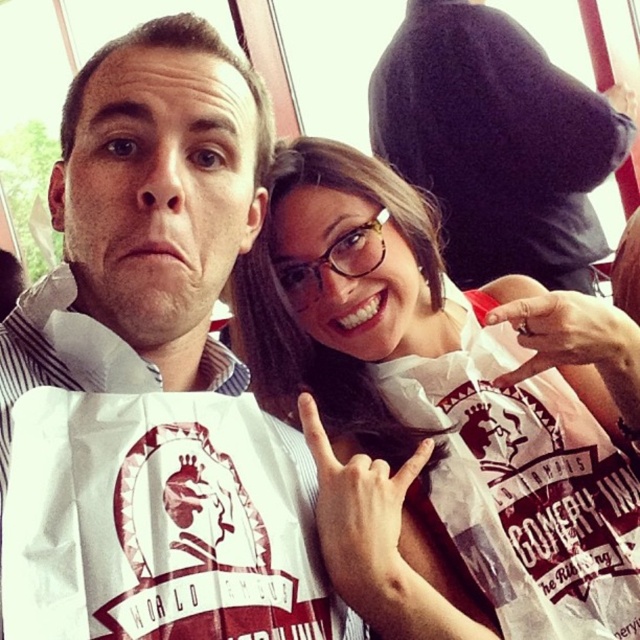
You are organizing a photo shoot and need to ensure that all items in the frame are correctly sized according to the client specifications. The client has specified that the white paper bag at center must be larger than the matte black shirt at upper center. Based on the image provided, does the current arrangement meet the client requirements? Please explain your reasoning.

The white paper bag at center is smaller than the matte black shirt at upper center, so the current arrangement does not meet the client requirement that the white paper bag at center must be larger than the matte black shirt at upper center.

You are taking a photo of two people standing side by side. You notice two points in the image at coordinates point (529, 502) and point (522, 77). Which point is closer to you?

Point (529, 502) is closer to the viewer than point (522, 77).